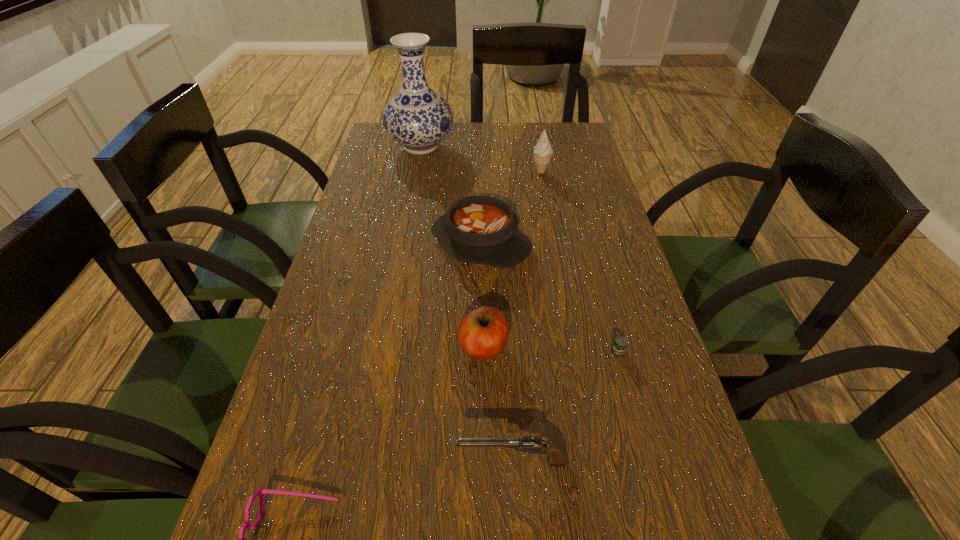
At what (x,y) coordinates should I click in order to perform the action: click on vacant area situated on the front of the vase. Please return your answer as a coordinate pair (x, y). This screenshot has width=960, height=540. Looking at the image, I should click on (409, 211).

Identify the location of free space located on the front-facing side of the sixth nearest object. This screenshot has width=960, height=540. (546, 199).

At what (x,y) coordinates should I click in order to perform the action: click on vacant space located 0.160m on the front of the apple. Please return your answer as a coordinate pair (x, y). This screenshot has width=960, height=540. Looking at the image, I should click on (484, 446).

The height and width of the screenshot is (540, 960). I want to click on free point located 0.130m on the front of the casserole, so click(481, 316).

Where is `vacant space located aiming along the barrel of the sixth farthest object`? The width and height of the screenshot is (960, 540). vacant space located aiming along the barrel of the sixth farthest object is located at coordinates (381, 461).

Locate an element on the screen. This screenshot has height=540, width=960. vacant region located aiming along the barrel of the sixth farthest object is located at coordinates (364, 461).

Find the location of a particular element. free location located aiming along the barrel of the sixth farthest object is located at coordinates (287, 461).

The height and width of the screenshot is (540, 960). Identify the location of free space located 0.330m on the left of the beer can. (430, 352).

Find the location of `object located at the far edge`. object located at the far edge is located at coordinates (417, 117).

Where is `object that is at the left edge`? object that is at the left edge is located at coordinates (417, 117).